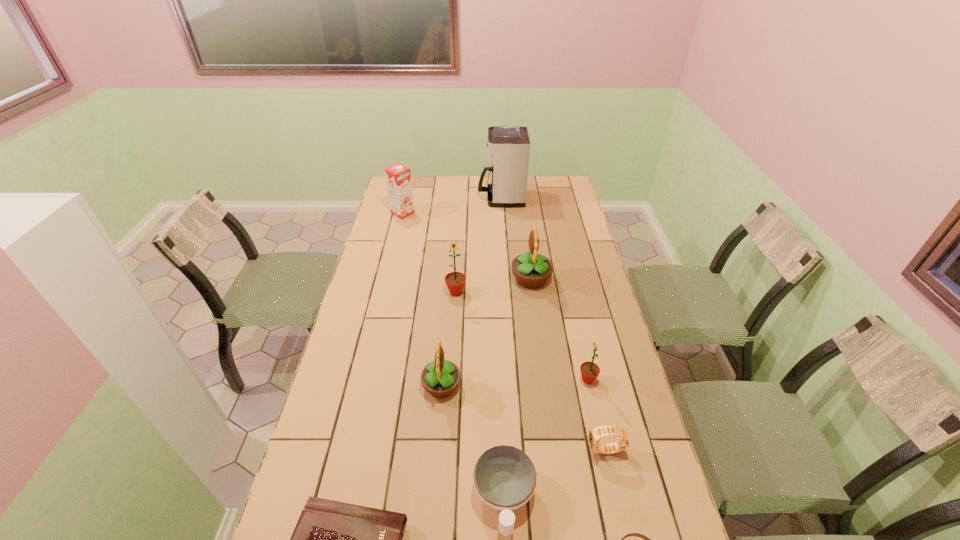
I want to click on vacant position at the far edge of the desktop, so click(438, 185).

Identify the location of vacant area at the left edge. (363, 309).

You are a GUI agent. You are given a task and a screenshot of the screen. Output one action in this format:
    pyautogui.click(x=<x>, y=<y>)
    Task: Click on the vacant space at the right edge of the desktop
    This screenshot has width=960, height=540.
    Given the screenshot: What is the action you would take?
    pyautogui.click(x=571, y=252)

Where is `blank area at the far right corner`? The image size is (960, 540). blank area at the far right corner is located at coordinates (569, 183).

I want to click on free space that is in between the black watch and the second sunflower from right to left, so click(568, 364).

Locate an element on the screen. The image size is (960, 540). empty space that is in between the right green sunflower and the bigger green sunflower is located at coordinates (521, 336).

Locate an element on the screen. The image size is (960, 540). unoccupied position between the black watch and the bigger yellow sunflower is located at coordinates (568, 364).

Identify the location of free spot between the carton and the tallest object. The width and height of the screenshot is (960, 540). (452, 205).

The height and width of the screenshot is (540, 960). Identify the location of the sixth closest object to the tallest object. [x=595, y=434].

Find the location of a particular element. object that is the closest to the hardback book is located at coordinates 504,477.